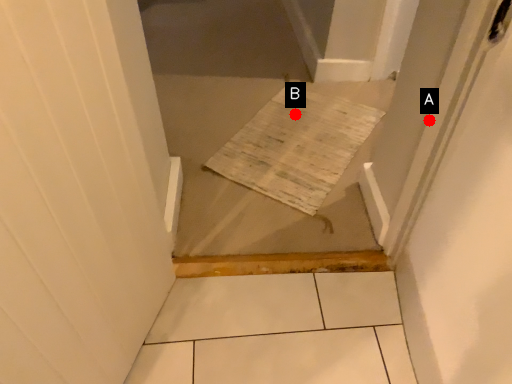
Question: Two points are circled on the image, labeled by A and B beside each circle. Which point appears closest to the camera in this image?

Choices:
 (A) A is closer
 (B) B is closer

Answer: (A)